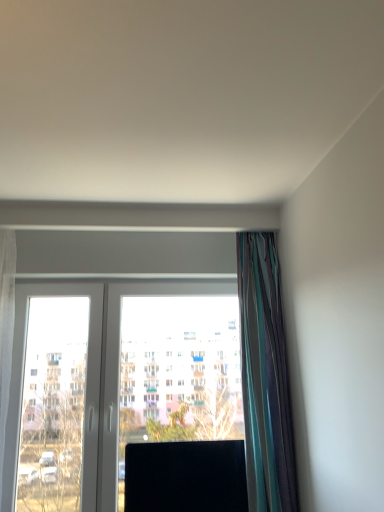
The height and width of the screenshot is (512, 384). Identify the location of transparent glass window at center. (176, 392).

The height and width of the screenshot is (512, 384). What do you see at coordinates (265, 377) in the screenshot?
I see `multicolored silky curtain at right` at bounding box center [265, 377].

In order to face multicolored silky curtain at right, should I rotate leftwards or rightwards?

You should look right and rotate roughly 8.537 degrees.

At what (x,y) coordinates should I click in order to perform the action: click on transparent glass window at center. Please return your answer as a coordinate pair (x, y). The image size is (384, 512). Looking at the image, I should click on (176, 392).

Measure the distance from multicolored silky curtain at right to transparent glass window at center.

multicolored silky curtain at right and transparent glass window at center are 14.53 inches apart from each other.

Is multicolored silky curtain at right beside transparent glass window at center?

No, multicolored silky curtain at right is not in contact with transparent glass window at center.

How many degrees apart are the facing directions of multicolored silky curtain at right and transparent glass window at center?

0.00111 degrees.

Which is more distant, (x=246, y=284) or (x=102, y=339)?

The point (x=102, y=339) is farther from the camera.

Is transparent glass window at center further to camera compared to multicolored silky curtain at right?

Yes, it is behind multicolored silky curtain at right.

Which of these two, transparent glass window at center or multicolored silky curtain at right, is wider?

multicolored silky curtain at right is wider.

Can you confirm if transparent glass window at center is positioned to the right of black glossy screen at center?

No.

Which object is wider, transparent glass window at center or black glossy screen at center?

black glossy screen at center.

You are a GUI agent. You are given a task and a screenshot of the screen. Output one action in this format:
    pyautogui.click(x=<x>, y=<y>)
    Task: Click on the window that is above the black glossy screen at center (from a real-world perspective)
    
    Given the screenshot: What is the action you would take?
    pyautogui.click(x=176, y=392)

Does point (267, 431) lie behind point (237, 442)?

No, it is in front of (237, 442).

Is multicolored silky curtain at right bigger or smaller than black glossy screen at center?

Clearly, multicolored silky curtain at right is larger in size than black glossy screen at center.

Find the location of a particular element. This screenshot has width=384, height=512. curtain on the right of black glossy screen at center is located at coordinates (265, 377).

From a real-world perspective, which is physically below, multicolored silky curtain at right or black glossy screen at center?

From a 3D spatial view, black glossy screen at center is below.

Is multicolored silky curtain at right oriented towards black glossy screen at center?

No, multicolored silky curtain at right is not turned towards black glossy screen at center.

Can transparent glass window at center be found inside black glossy screen at center?

Definitely not — transparent glass window at center is not inside black glossy screen at center.

Is black glossy screen at center positioned far away from transparent glass window at center?

No, black glossy screen at center is not far from transparent glass window at center.

Which object is further away from the camera, black glossy screen at center or transparent glass window at center?

transparent glass window at center is further away from the camera.

Does point (149, 502) come in front of point (271, 502)?

No.

Considering the sizes of objects black glossy screen at center and multicolored silky curtain at right in the image provided, who is bigger, black glossy screen at center or multicolored silky curtain at right?

multicolored silky curtain at right.

Which object is thinner, black glossy screen at center or multicolored silky curtain at right?

Thinner between the two is black glossy screen at center.

Could you tell me if black glossy screen at center is facing multicolored silky curtain at right?

No.

How far apart are black glossy screen at center and multicolored silky curtain at right?

black glossy screen at center and multicolored silky curtain at right are 16.78 inches apart.

This screenshot has height=512, width=384. In order to click on curtain on the right of transparent glass window at center in this screenshot , I will do `click(265, 377)`.

This screenshot has width=384, height=512. In the image, there is a multicolored silky curtain at right. Identify the location of window below it (from the image's perspective). (176, 392).

Considering their positions, is black glossy screen at center positioned closer to multicolored silky curtain at right than transparent glass window at center?

transparent glass window at center is closer to multicolored silky curtain at right.

From the image, which object appears to be farther from transparent glass window at center, black glossy screen at center or multicolored silky curtain at right?

Answer: multicolored silky curtain at right is positioned further to the anchor transparent glass window at center.

When comparing their distances from multicolored silky curtain at right, does transparent glass window at center or black glossy screen at center seem closer?

transparent glass window at center is positioned closer to the anchor multicolored silky curtain at right.

Estimate the real-world distances between objects in this image. Which object is further from black glossy screen at center, multicolored silky curtain at right or transparent glass window at center?

Among the two, multicolored silky curtain at right is located further to black glossy screen at center.

From the image, which object appears to be farther from transparent glass window at center, multicolored silky curtain at right or black glossy screen at center?

Based on the image, multicolored silky curtain at right appears to be further to transparent glass window at center.

Looking at the image, which one is located further to black glossy screen at center, transparent glass window at center or multicolored silky curtain at right?

multicolored silky curtain at right.

Find the location of `window screen between transparent glass window at center and multicolored silky curtain at right`. window screen between transparent glass window at center and multicolored silky curtain at right is located at coordinates (185, 476).